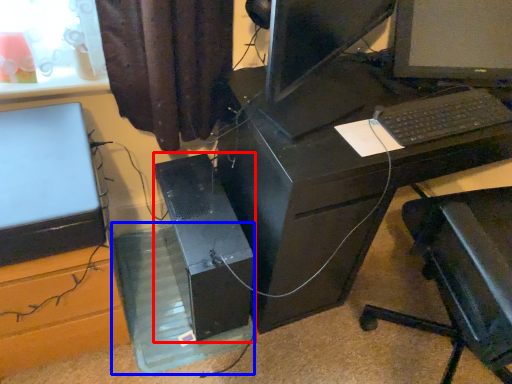
Question: Which object is closer to the camera taking this photo, computer tower (highlighted by a red box) or glass box (highlighted by a blue box)?

Choices:
 (A) computer tower
 (B) glass box

Answer: (A)